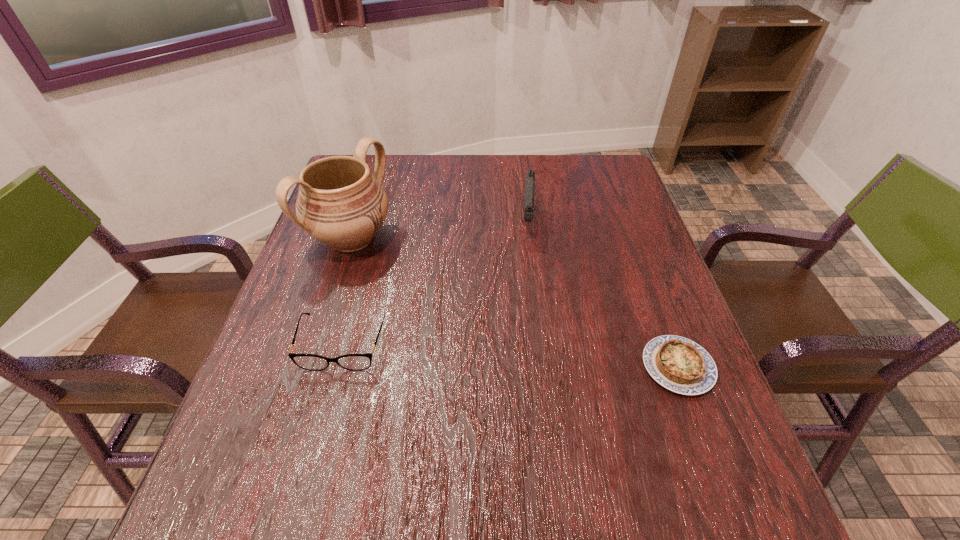
Image resolution: width=960 pixels, height=540 pixels. Find the location of `vacant spot on the desktop that is between the spectacles and the quiche and is positioned on the front-facing side of the urn`. vacant spot on the desktop that is between the spectacles and the quiche and is positioned on the front-facing side of the urn is located at coordinates (556, 359).

Where is `vacant spot on the desktop that is between the third tallest object and the quiche and is positioned at the barrel of the pistol`? The height and width of the screenshot is (540, 960). vacant spot on the desktop that is between the third tallest object and the quiche and is positioned at the barrel of the pistol is located at coordinates (521, 356).